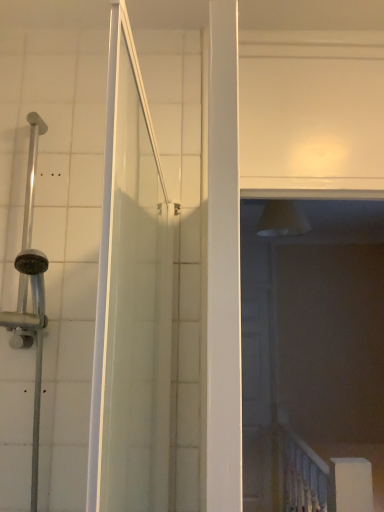
Question: Is point pyautogui.click(x=256, y=258) closer or farther from the camera than point pyautogui.click(x=301, y=507)?

Choices:
 (A) closer
 (B) farther

Answer: (B)

Question: Considering the positions of transparent plastic screen door at center and white glossy rail at lower right in the image, is transparent plastic screen door at center taller or shorter than white glossy rail at lower right?

Choices:
 (A) short
 (B) tall

Answer: (B)

Question: Is transparent plastic screen door at center bigger or smaller than white glossy rail at lower right?

Choices:
 (A) small
 (B) big

Answer: (A)

Question: Considering the positions of white glossy rail at lower right and transparent plastic screen door at center in the image, is white glossy rail at lower right wider or thinner than transparent plastic screen door at center?

Choices:
 (A) wide
 (B) thin

Answer: (A)

Question: From a real-world perspective, is white glossy rail at lower right physically located above or below transparent plastic screen door at center?

Choices:
 (A) below
 (B) above

Answer: (A)

Question: Is point (309, 480) closer or farther from the camera than point (258, 298)?

Choices:
 (A) farther
 (B) closer

Answer: (B)

Question: Is white glossy rail at lower right taller or shorter than transparent plastic screen door at center?

Choices:
 (A) short
 (B) tall

Answer: (A)